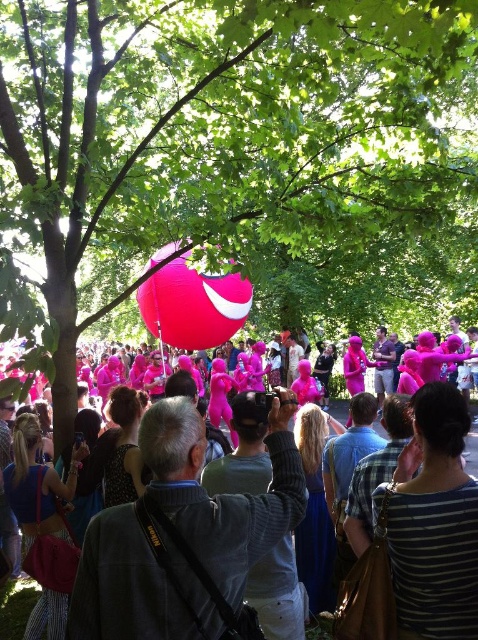
Question: Which point is farther to the camera?

Choices:
 (A) pink matte balloon at center
 (B) green leafy tree at upper center

Answer: (A)

Question: Estimate the real-world distances between objects in this image. Which object is closer to the pink matte balloon at center?

Choices:
 (A) green leafy tree at upper center
 (B) glossy pink balloon at center

Answer: (B)

Question: Is glossy pink balloon at center positioned in front of pink matte balloon at center?

Choices:
 (A) no
 (B) yes

Answer: (A)

Question: Is glossy pink balloon at center closer to the viewer compared to pink matte balloon at center?

Choices:
 (A) no
 (B) yes

Answer: (A)

Question: Where is green leafy tree at upper center located in relation to pink matte balloon at center in the image?

Choices:
 (A) below
 (B) above

Answer: (B)

Question: Which point is closer to the camera taking this photo?

Choices:
 (A) (338, 420)
 (B) (254, 42)
 (C) (204, 275)

Answer: (B)